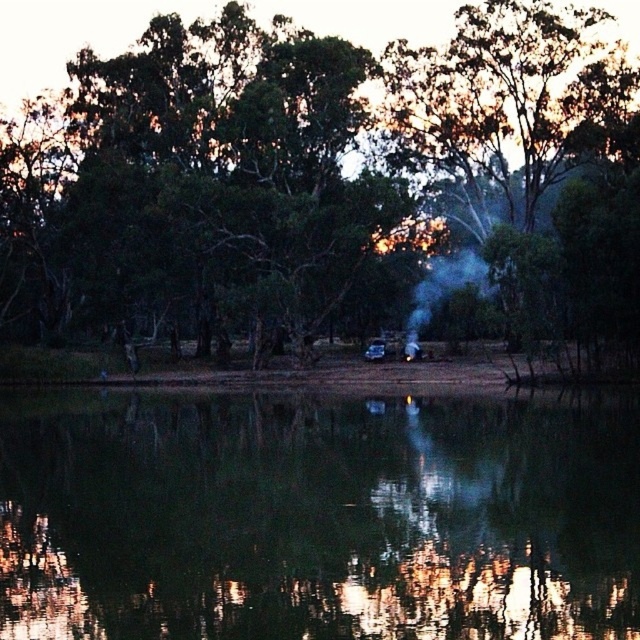
Question: Is green reflective water at center to the left of white smoke at center from the viewer's perspective?

Choices:
 (A) yes
 (B) no

Answer: (A)

Question: Is green reflective water at center positioned behind white smoke at center?

Choices:
 (A) no
 (B) yes

Answer: (A)

Question: Which point is closer to the camera taking this photo?

Choices:
 (A) (128, 124)
 (B) (467, 42)
 (C) (52, 596)

Answer: (C)

Question: Does green reflective water at center have a smaller size compared to white smoke at center?

Choices:
 (A) yes
 (B) no

Answer: (B)

Question: Considering the real-world distances, which object is closest to the white smoke at center?

Choices:
 (A) green leafy tree at center
 (B) green leafy tree at right

Answer: (B)

Question: Which of the following is the closest to the observer?

Choices:
 (A) green reflective water at center
 (B) green leafy tree at center

Answer: (A)